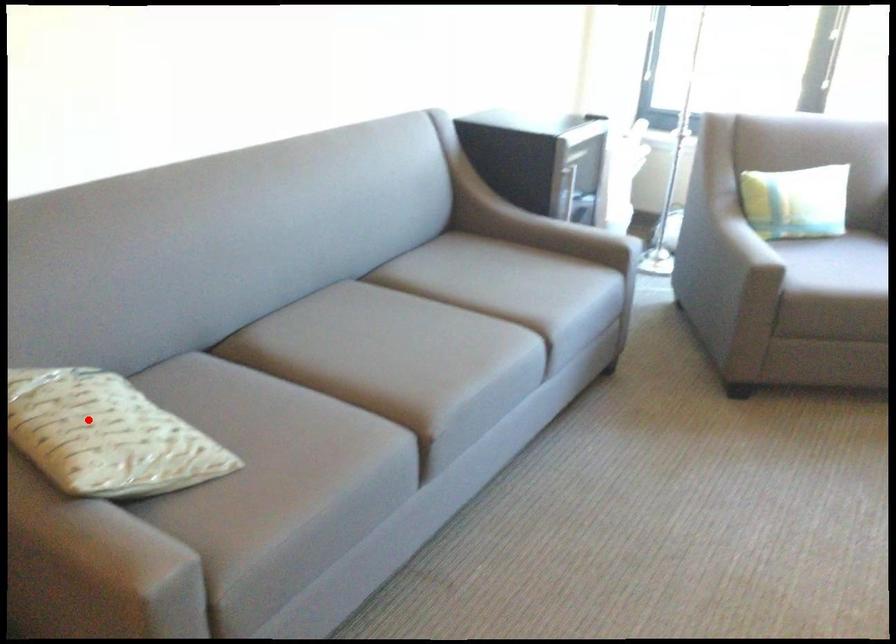
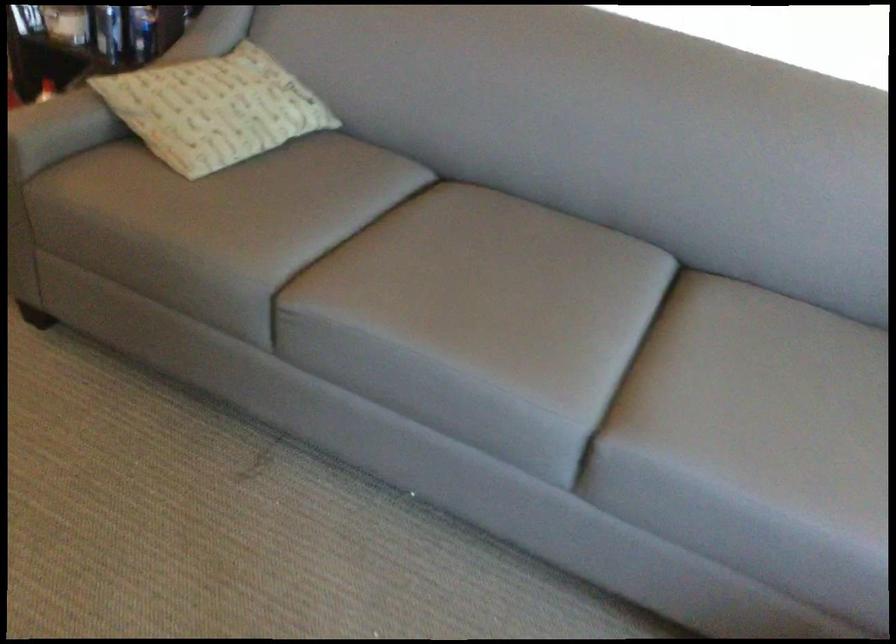
In the second image, find the point that corresponds to the highlighted location in the first image.

(214, 93)